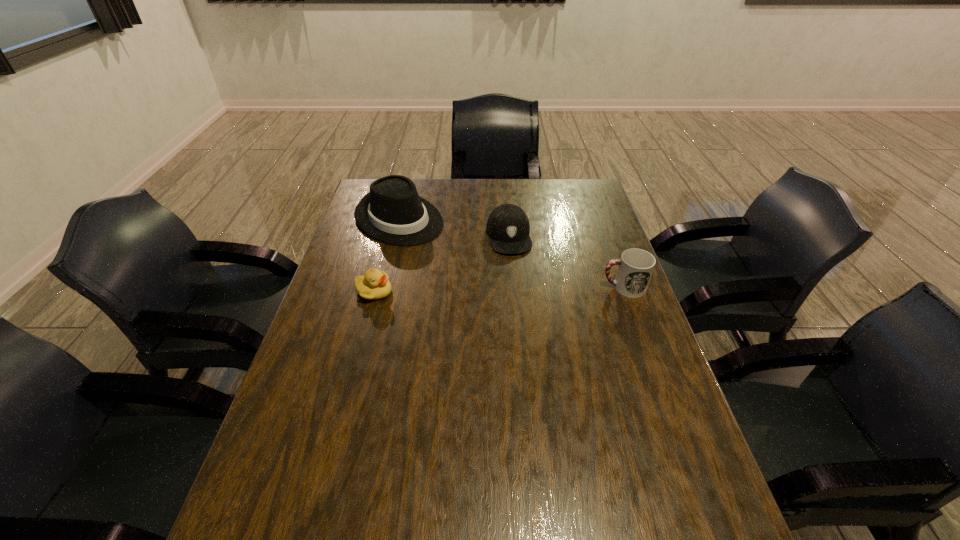
The height and width of the screenshot is (540, 960). I want to click on free space on the desktop that is between the duckling and the cup and is positioned on the front-facing side of the cap, so pos(519,289).

You are a GUI agent. You are given a task and a screenshot of the screen. Output one action in this format:
    pyautogui.click(x=<x>, y=<y>)
    Task: Click on the free space on the desktop that is between the duckling and the cup and is positioned on the front-facing side of the tallest object
    The height and width of the screenshot is (540, 960).
    Given the screenshot: What is the action you would take?
    pyautogui.click(x=498, y=289)